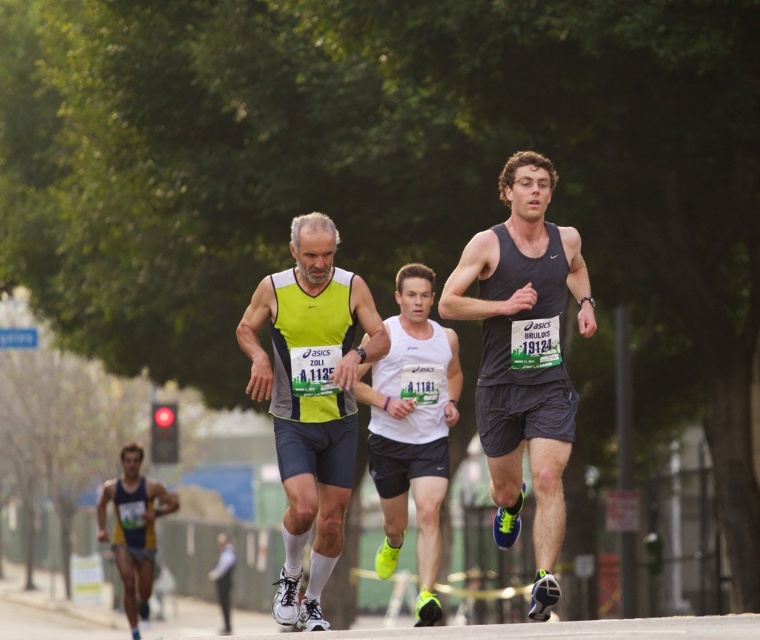
Question: Which of these objects is positioned closest to the neon yellow fabric tank top at center?

Choices:
 (A) dark gray tank top at center
 (B) white matte tank top at center

Answer: (A)

Question: Considering the relative positions of dark gray tank top at center and white matte tank top at center in the image provided, where is dark gray tank top at center located with respect to white matte tank top at center?

Choices:
 (A) below
 (B) above

Answer: (B)

Question: Is dark gray tank top at center in front of blue and yellow athletic wear at lower left?

Choices:
 (A) no
 (B) yes

Answer: (B)

Question: Considering the real-world distances, which object is closest to the blue and yellow athletic wear at lower left?

Choices:
 (A) dark gray tank top at center
 (B) white matte tank top at center
 (C) neon yellow fabric tank top at center

Answer: (B)

Question: Estimate the real-world distances between objects in this image. Which object is closer to the dark gray tank top at center?

Choices:
 (A) blue and yellow athletic wear at lower left
 (B) white matte tank top at center
 (C) neon yellow fabric tank top at center

Answer: (C)

Question: Can you confirm if dark gray tank top at center is positioned to the right of neon yellow fabric tank top at center?

Choices:
 (A) no
 (B) yes

Answer: (B)